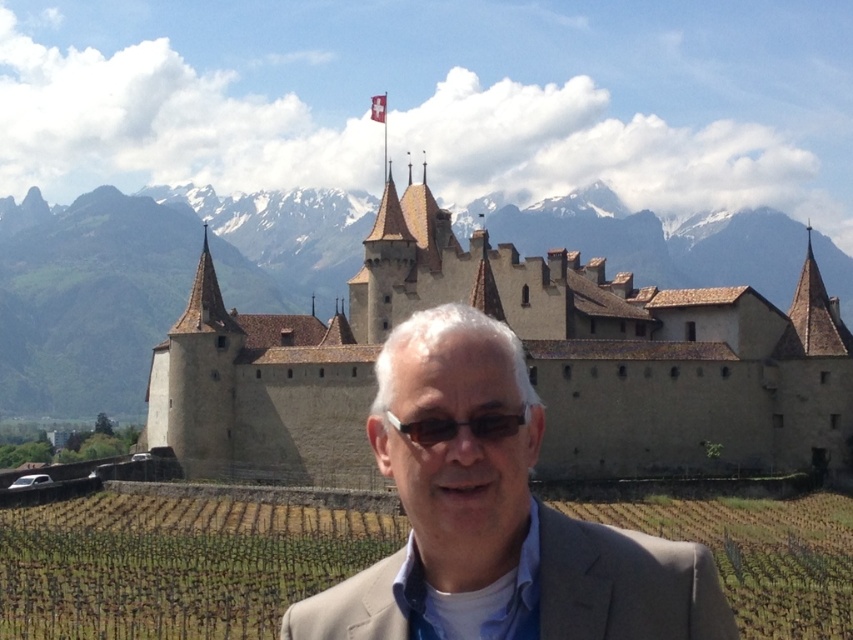
Is point (456, 618) closer to camera compared to point (497, 435)?

That is True.

Looking at this image, does light brown suit at center have a lesser height compared to sunglasses at center?

Incorrect, light brown suit at center's height does not fall short of sunglasses at center's.

Who is more distant from viewer, (373, 579) or (517, 419)?

Point (373, 579)

The height and width of the screenshot is (640, 853). I want to click on light brown suit at center, so click(x=496, y=518).

Does beige stone castle at center have a smaller size compared to sunglasses at center?

Actually, beige stone castle at center might be larger than sunglasses at center.

Is point (740, 422) closer to camera compared to point (415, 440)?

No, it is not.

At what (x,y) coordinates should I click in order to perform the action: click on beige stone castle at center. Please return your answer as a coordinate pair (x, y). The width and height of the screenshot is (853, 640). Looking at the image, I should click on (520, 358).

Find the location of a particular element. This screenshot has width=853, height=640. beige stone castle at center is located at coordinates (520, 358).

Which is above, beige stone castle at center or light brown suit at center?

Positioned higher is beige stone castle at center.

Between beige stone castle at center and light brown suit at center, which one appears on the left side from the viewer's perspective?

From the viewer's perspective, beige stone castle at center appears more on the left side.

Where is `beige stone castle at center`? beige stone castle at center is located at coordinates (520, 358).